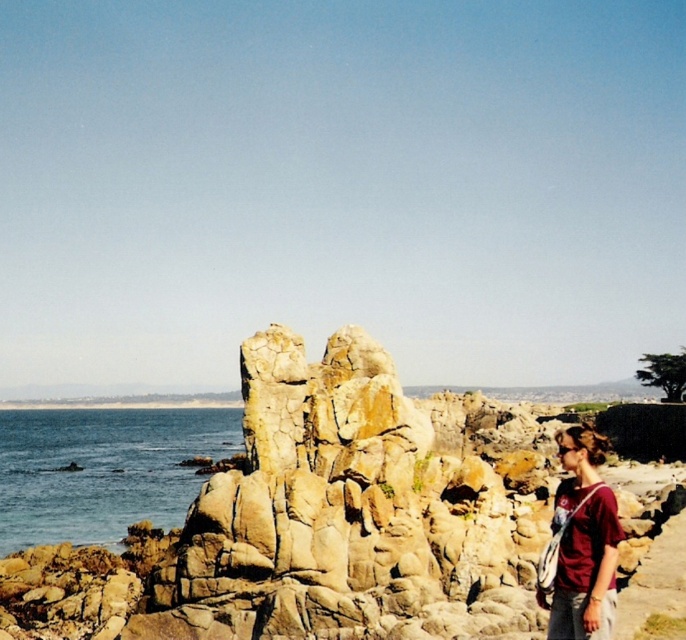
You are standing at the center of the scene and want to take a photo of the blue water at left without the matte red shirt at lower right appearing in the frame. Is this possible based on their positions?

The matte red shirt at lower right is behind the blue water at left, so if you position yourself so the blue water at left is in front, the matte red shirt at lower right will not be visible in the photo.

You are planning to take a photo of the blue water at left and the matte red shirt at lower right. Which object should be placed closer to the center of the frame to ensure both are visible in the photo?

The blue water at left should be placed closer to the center of the frame because it is wider than the matte red shirt at lower right, ensuring both objects are visible in the photo.